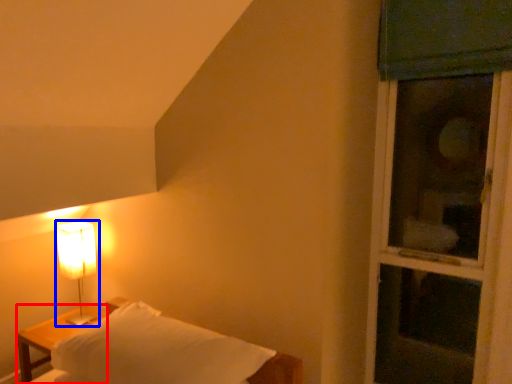
Question: Among these objects, which one is nearest to the camera, nightstand (highlighted by a red box) or lamp (highlighted by a blue box)?

Choices:
 (A) nightstand
 (B) lamp

Answer: (A)